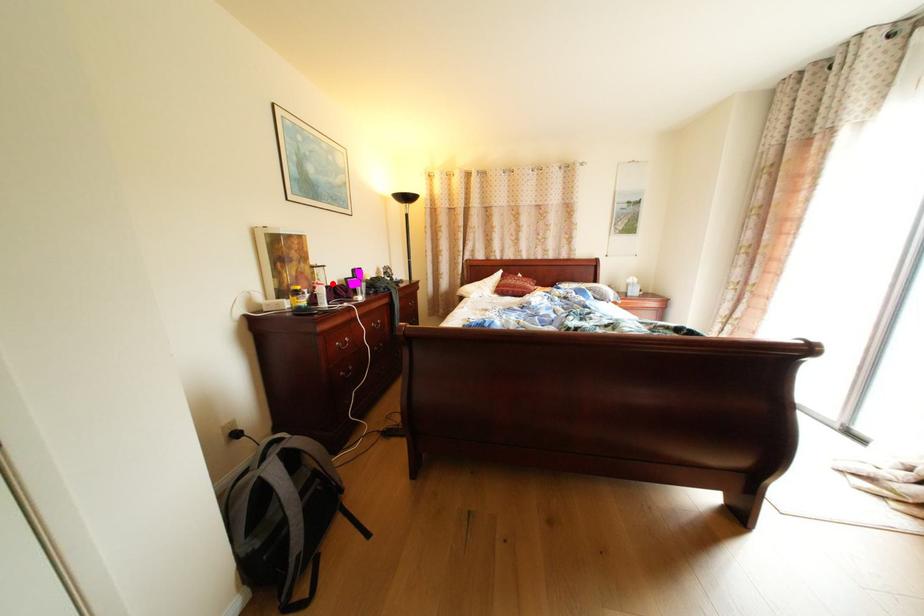
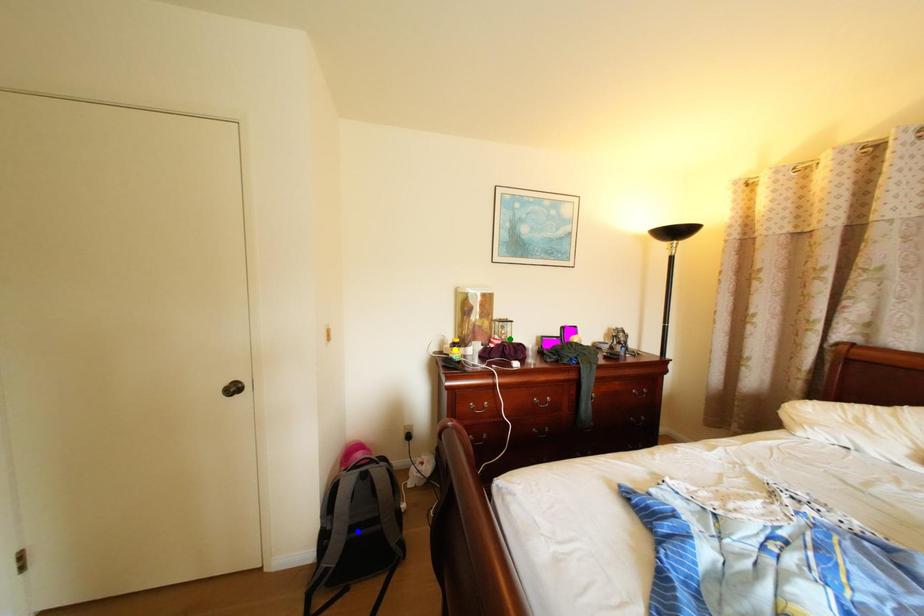
Question: I am providing you with two images of the same scene from different viewpoints. A red point is marked on the first image. You are given multiple points on the second image. Which point in image 2 represents the same 3d spot as the red point in image 1?

Choices:
 (A) green point
 (B) blue point
 (C) yellow point

Answer: (A)